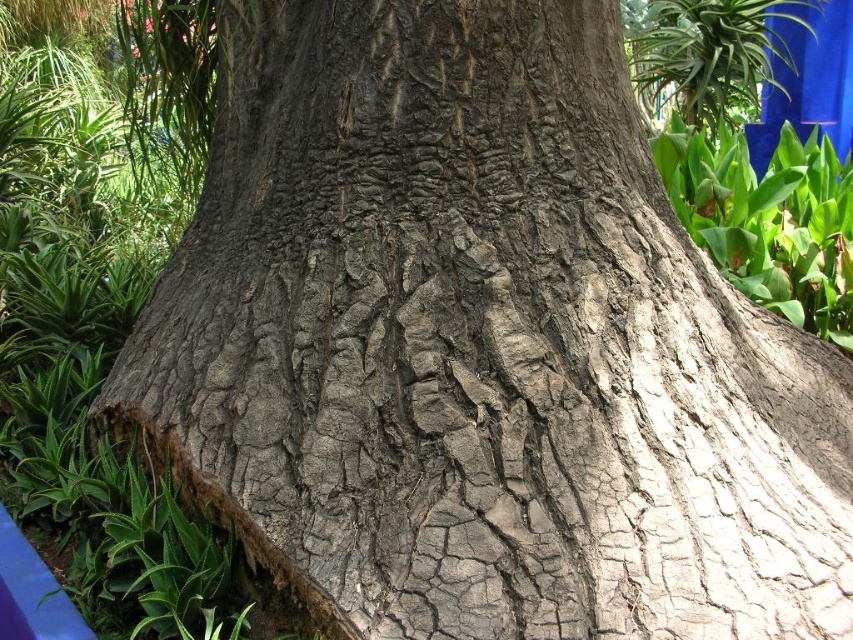
You are standing in front of the large tree trunk and notice two green leafy plants. One is labeled as the green leafy plant at right, and the other is the green leafy plant at upper right. From your perspective, which plant is positioned to the left of the other?

The green leafy plant at right is positioned to the left of the green leafy plant at upper right.

You are standing in front of the large tree trunk and want to determine the relative positions of two points marked on the image. Which point is closer to you, point (693, 172) or point (781, 42)?

Point (693, 172) is closer to the viewer than point (781, 42).